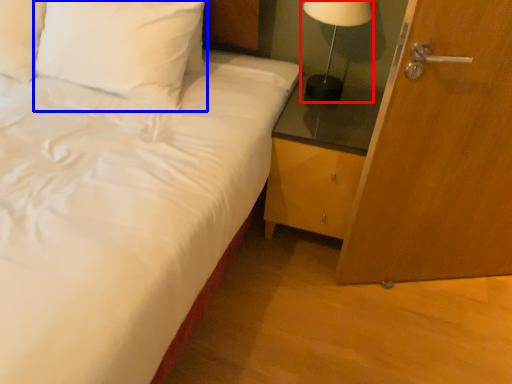
Question: Which object is closer to the camera taking this photo, table lamp (highlighted by a red box) or pillow (highlighted by a blue box)?

Choices:
 (A) table lamp
 (B) pillow

Answer: (B)